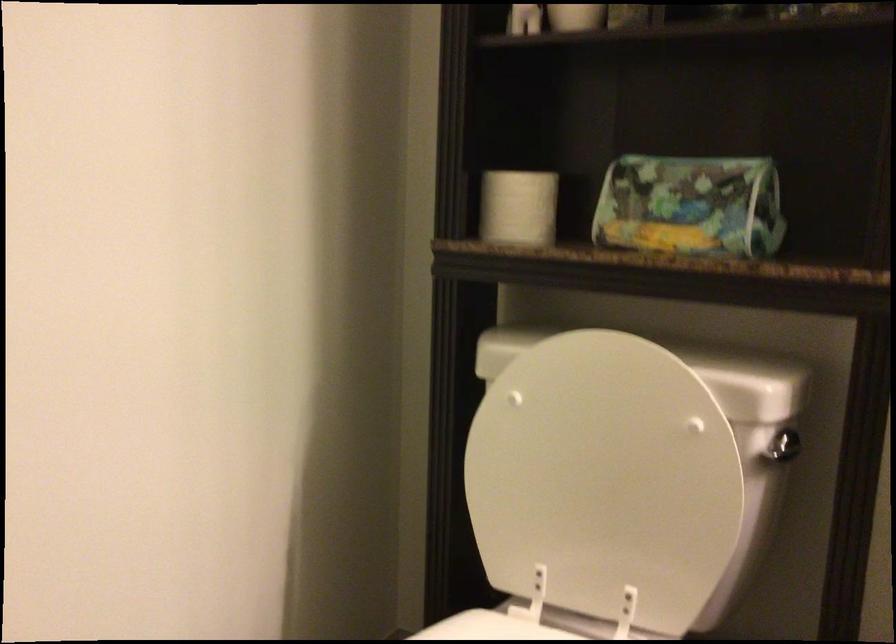
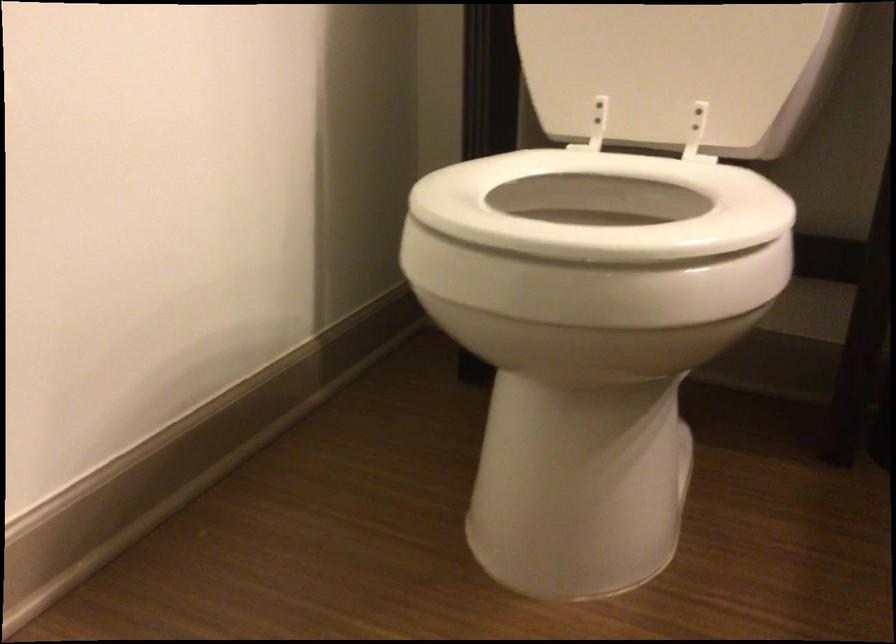
Question: The images are taken continuously from a first-person perspective. In which direction are you moving?

Choices:
 (A) Left
 (B) Right
 (C) Forward
 (D) Backward

Answer: (A)